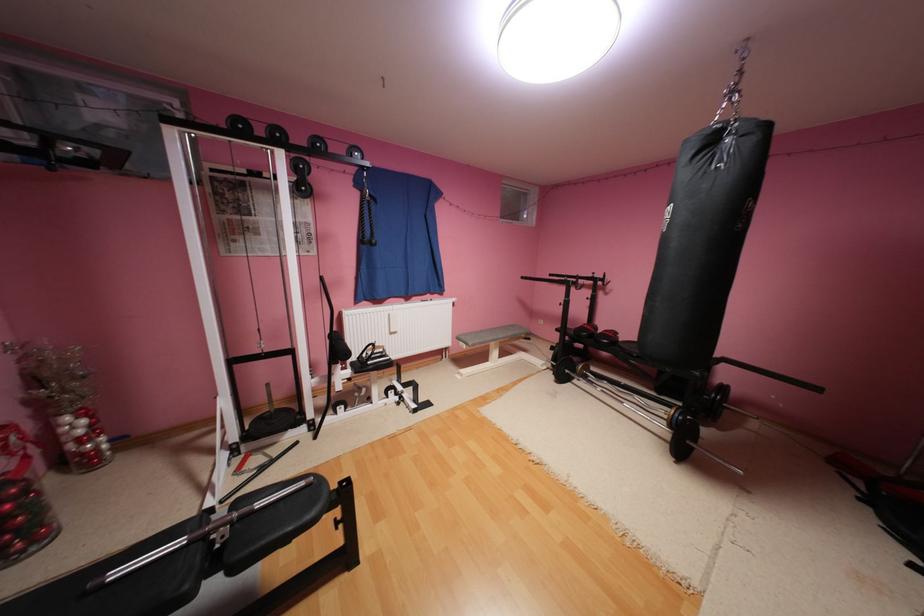
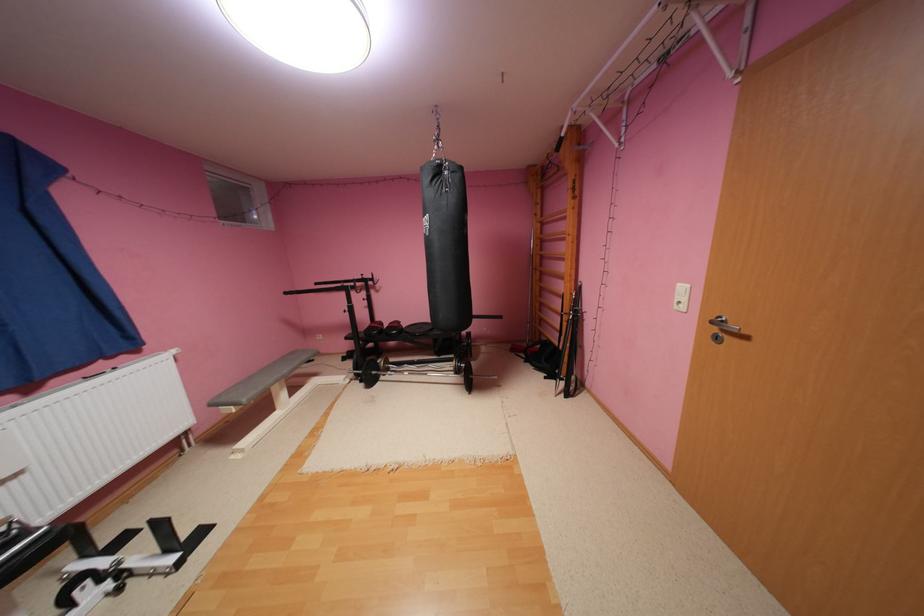
The point at (850,464) is marked in the first image. Where is the corresponding point in the second image?

(524, 350)